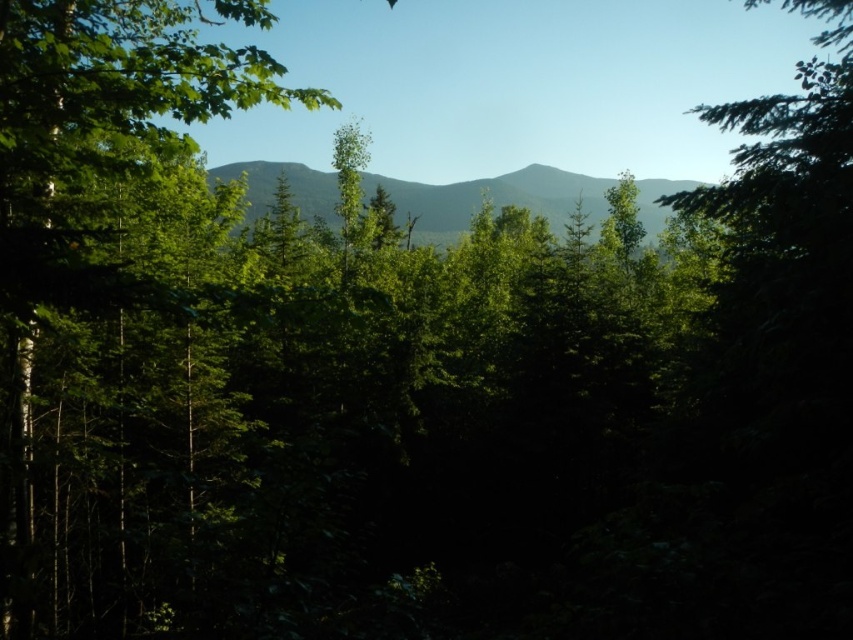
You are standing in the forest depicted in the scene. You notice a point marked at coordinates (94, 134). Based on the description, what object is located at that point?

The point at coordinates (94, 134) indicates a green leafy tree at left.

You are hiking in the forest and want to take a photo of the green leafy tree at left and the green textured mountain at center. Which object should you focus on first if you want both to be in sharp focus?

The green leafy tree at left is taller than the green textured mountain at center, so focusing on the green leafy tree at left will help ensure both are in focus since it is closer to the camera.